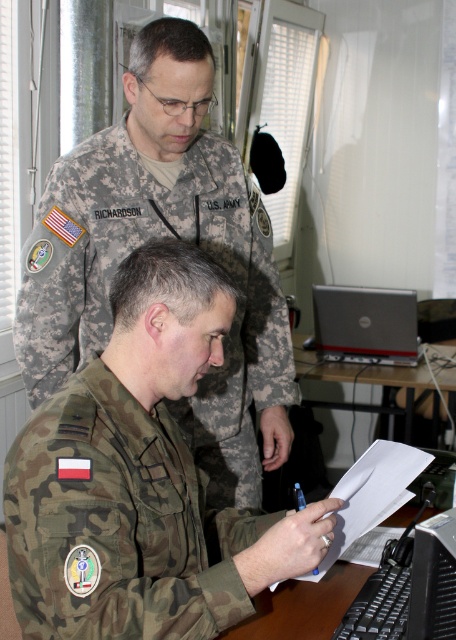
You are an observer in the office scene. You notice two camo fabric uniforms. Which one is closer to you, the camo fabric uniform at lower center or the camo fabric uniform at lower left?

The camo fabric uniform at lower center is closer to you because it is in front of the camo fabric uniform at lower left.

You are a military officer in the office. You need to type a report on the black plastic keyboard at lower center. Where exactly should you place your hands to start typing?

To start typing on the black plastic keyboard at lower center, position your fingers on the home row keys. Typically, the left hand rests on A, S, D, F, and the right hand on J, K, L, semicolon. This standard QWERTY keyboard layout ensures efficient typing.